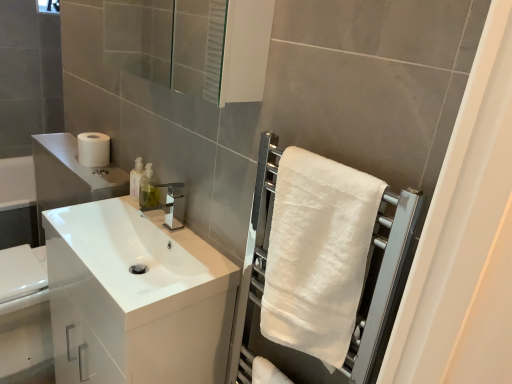
Question: Is transparent glass mirror at upper center at the right side of white glossy cabinet at left?

Choices:
 (A) yes
 (B) no

Answer: (A)

Question: From a real-world perspective, is transparent glass mirror at upper center located beneath white glossy cabinet at left?

Choices:
 (A) no
 (B) yes

Answer: (A)

Question: From the image's perspective, is transparent glass mirror at upper center on top of white glossy cabinet at left?

Choices:
 (A) no
 (B) yes

Answer: (B)

Question: Does transparent glass mirror at upper center have a larger size compared to white glossy cabinet at left?

Choices:
 (A) yes
 (B) no

Answer: (B)

Question: From the image's perspective, would you say transparent glass mirror at upper center is shown under white glossy cabinet at left?

Choices:
 (A) no
 (B) yes

Answer: (A)

Question: Considering the relative sizes of transparent glass mirror at upper center and white glossy cabinet at left in the image provided, is transparent glass mirror at upper center shorter than white glossy cabinet at left?

Choices:
 (A) yes
 (B) no

Answer: (A)

Question: Does translucent plastic soap dispenser at center come behind white matte toilet paper at left?

Choices:
 (A) yes
 (B) no

Answer: (B)

Question: Is translucent plastic soap dispenser at center oriented towards white matte toilet paper at left?

Choices:
 (A) no
 (B) yes

Answer: (A)

Question: From the image's perspective, is translucent plastic soap dispenser at center on top of white matte toilet paper at left?

Choices:
 (A) yes
 (B) no

Answer: (B)

Question: Does translucent plastic soap dispenser at center have a greater width compared to white matte toilet paper at left?

Choices:
 (A) yes
 (B) no

Answer: (B)

Question: From a real-world perspective, does translucent plastic soap dispenser at center stand above white matte toilet paper at left?

Choices:
 (A) no
 (B) yes

Answer: (A)

Question: Is white matte toilet paper at left inside translucent plastic soap dispenser at center?

Choices:
 (A) no
 (B) yes

Answer: (A)

Question: Is transparent glass mirror at upper center far away from white soft towel at right?

Choices:
 (A) no
 (B) yes

Answer: (B)